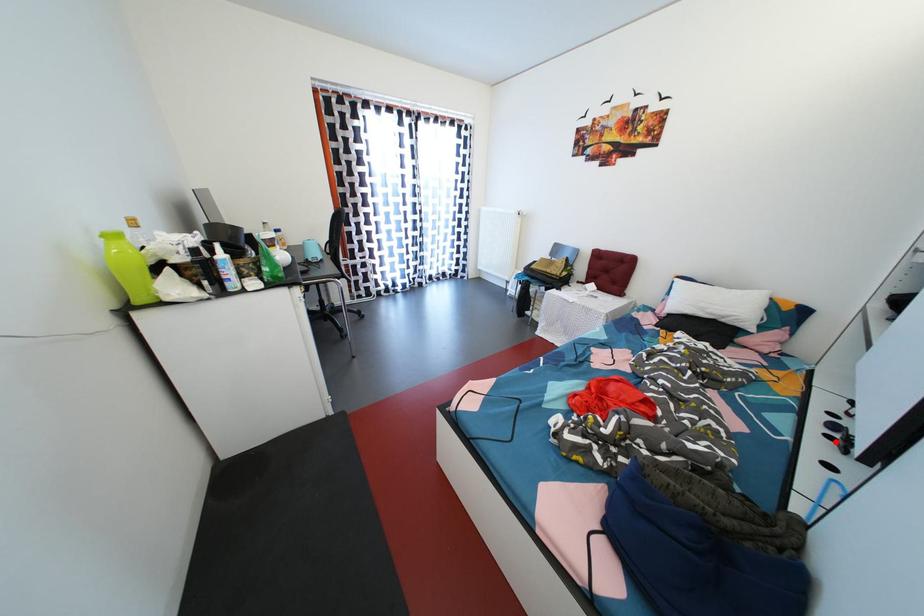
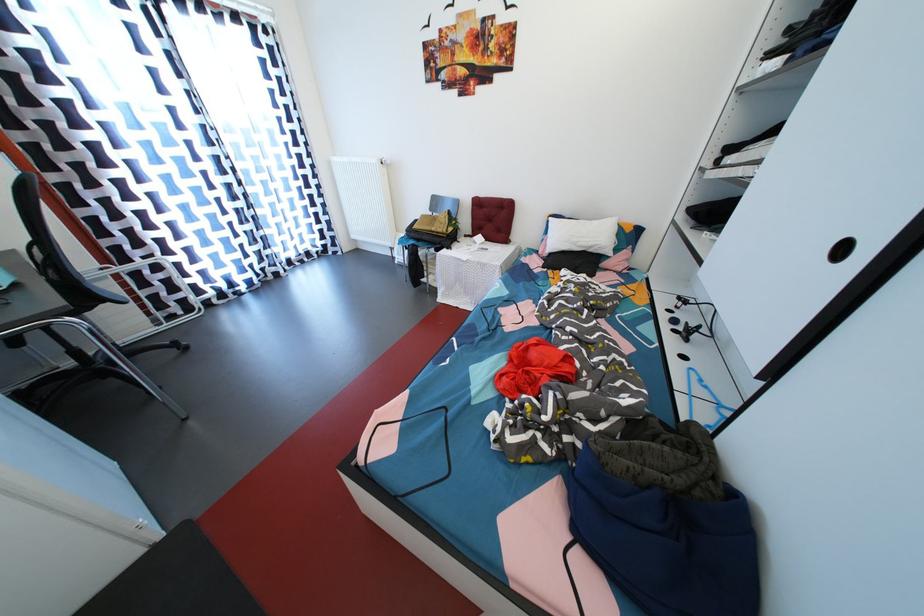
Question: I am providing you with two images of the same scene from different viewpoints. Given a red point in image1, look at the same physical point in image2. Is it:

Choices:
 (A) Closer to the viewpoint
 (B) Farther from the viewpoint

Answer: (A)